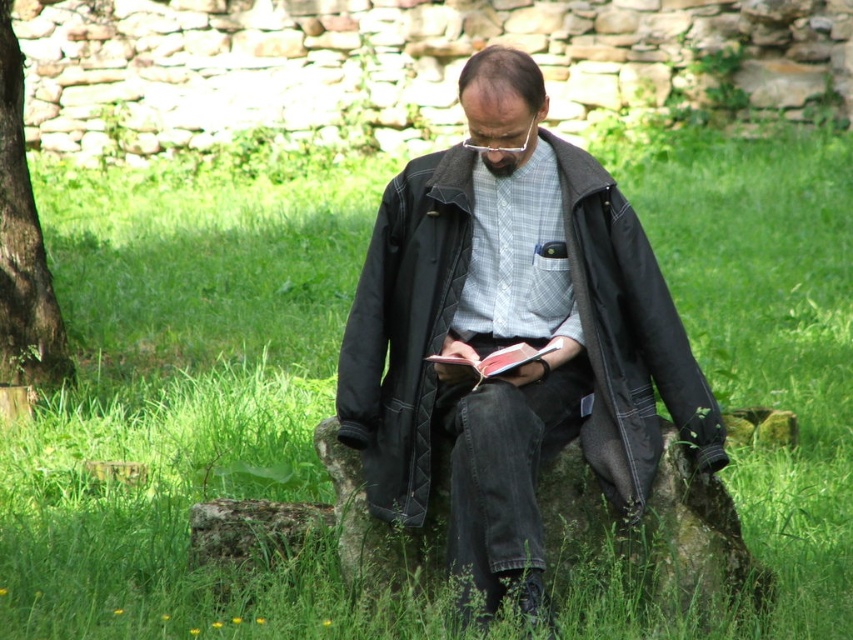
You are a photographer trying to capture the matte black jacket at center and the dark brown bark at left in a single frame. Based on their positions, which object should you focus on first to ensure both are in the shot?

The matte black jacket at center is positioned on the right side of dark brown bark at left, so you should focus on the dark brown bark at left first to ensure both objects are included in the frame.

You are a photographer wanting to capture a candid shot of the man reading his book. You have a camera that requires you to be at least 14 feet away to avoid disturbing him. Is the distance between you and the matte black jacket at center sufficient for your camera requirements?

The distance between the matte black jacket at center and the camera is 14.40 feet, which exceeds the minimum requirement of 14 feet. Therefore, the distance is sufficient for your camera requirements.